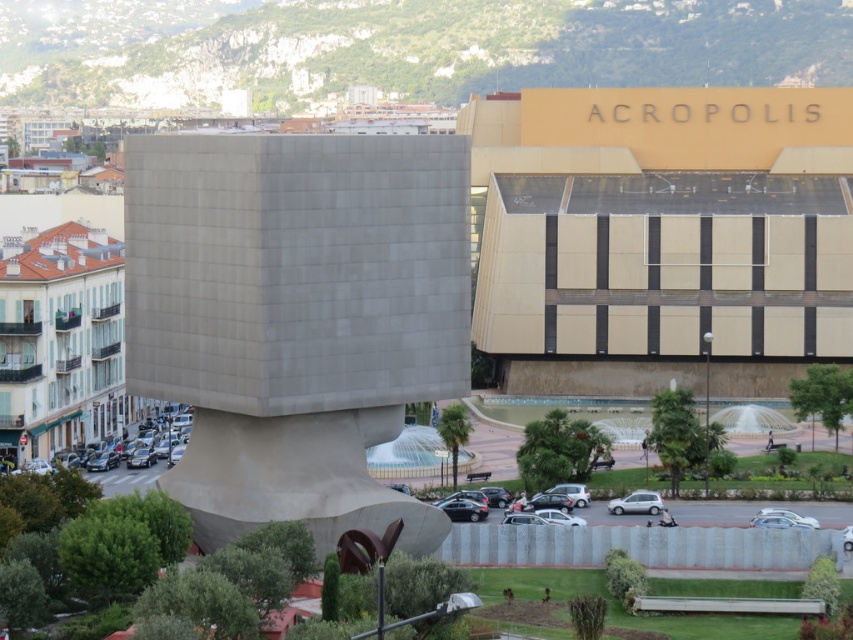
Question: Can you confirm if green painted wood hotel at left is wider than silver metallic car at center?

Choices:
 (A) no
 (B) yes

Answer: (B)

Question: Does green painted wood hotel at left appear on the right side of silver metallic car at lower center?

Choices:
 (A) no
 (B) yes

Answer: (A)

Question: Which point is closer to the camera?

Choices:
 (A) (177, 435)
 (B) (576, 484)
 (C) (636, 512)

Answer: (C)

Question: Can you confirm if beige textured building at upper right is positioned below silver metallic car at lower right?

Choices:
 (A) yes
 (B) no

Answer: (B)

Question: Among these points, which one is nearest to the camera?

Choices:
 (A) (625, 509)
 (B) (474, 518)
 (C) (51, 289)
 (D) (763, 509)

Answer: (B)

Question: Which of the following is the closest to the observer?

Choices:
 (A) beige textured building at upper right
 (B) green painted wood hotel at left
 (C) silver metallic car at lower center
 (D) shiny black car at center

Answer: (A)